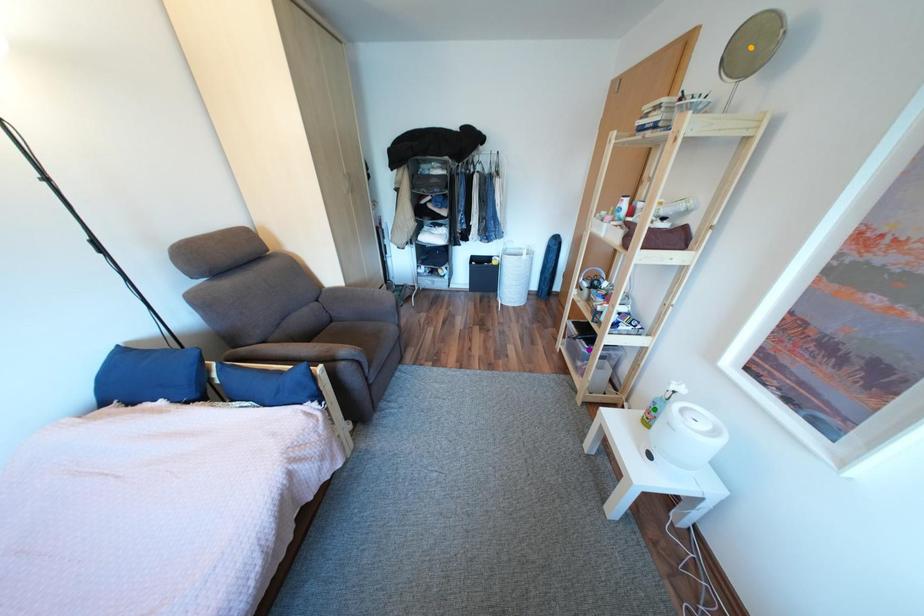
Order these from farthest to nearest:
- purple point
- orange point
- green point

purple point < green point < orange point